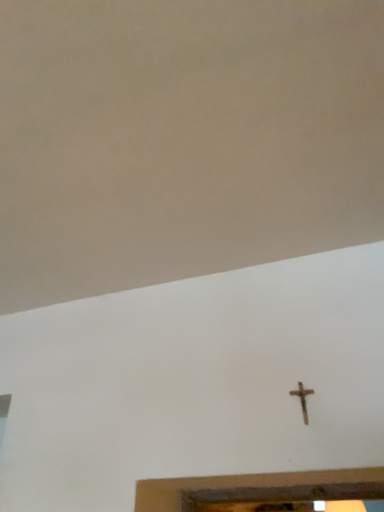
Find the location of a particular element. rusty metal cross at center-right is located at coordinates (302, 399).

Describe the element at coordinates (302, 399) in the screenshot. This screenshot has height=512, width=384. I see `rusty metal cross at center-right` at that location.

Locate an element on the screen. The image size is (384, 512). beige matte wall at upper center is located at coordinates (183, 140).

The height and width of the screenshot is (512, 384). What do you see at coordinates (183, 140) in the screenshot?
I see `beige matte wall at upper center` at bounding box center [183, 140].

This screenshot has height=512, width=384. What are the coordinates of `rusty metal cross at center-right` in the screenshot? It's located at (302, 399).

Between rusty metal cross at center-right and beige matte wall at upper center, which one appears on the right side from the viewer's perspective?

rusty metal cross at center-right is more to the right.

Between rusty metal cross at center-right and beige matte wall at upper center, which one is positioned behind?

rusty metal cross at center-right is more distant.

Does point (300, 382) come behind point (264, 163)?

Yes, it is.

From the image's perspective, is rusty metal cross at center-right located above beige matte wall at upper center?

Actually, rusty metal cross at center-right appears below beige matte wall at upper center in the image.

From a real-world perspective, is rusty metal cross at center-right located higher than beige matte wall at upper center?

Incorrect, from a real-world perspective, rusty metal cross at center-right is lower than beige matte wall at upper center.

Is rusty metal cross at center-right thinner than beige matte wall at upper center?

Correct, the width of rusty metal cross at center-right is less than that of beige matte wall at upper center.

Is rusty metal cross at center-right taller or shorter than beige matte wall at upper center?

Clearly, rusty metal cross at center-right is taller compared to beige matte wall at upper center.

In terms of size, does rusty metal cross at center-right appear bigger or smaller than beige matte wall at upper center?

Clearly, rusty metal cross at center-right is smaller in size than beige matte wall at upper center.

Is rusty metal cross at center-right completely or partially outside of beige matte wall at upper center?

Indeed, rusty metal cross at center-right is completely outside beige matte wall at upper center.

Is rusty metal cross at center-right in contact with beige matte wall at upper center?

rusty metal cross at center-right is not next to beige matte wall at upper center, and they're not touching.

Does rusty metal cross at center-right turn towards beige matte wall at upper center?

No, rusty metal cross at center-right is not facing towards beige matte wall at upper center.

Measure the distance from rusty metal cross at center-right to beige matte wall at upper center.

A distance of 78.89 centimeters exists between rusty metal cross at center-right and beige matte wall at upper center.

Locate an element on the screen. The image size is (384, 512). nail behind the beige matte wall at upper center is located at coordinates (302, 399).

Between beige matte wall at upper center and rusty metal cross at center-right, which one appears on the right side from the viewer's perspective?

Positioned to the right is rusty metal cross at center-right.

Considering their positions, is beige matte wall at upper center located in front of or behind rusty metal cross at center-right?

Clearly, beige matte wall at upper center is in front of rusty metal cross at center-right.

Considering the points (44, 214) and (291, 391), which point is in front, point (44, 214) or point (291, 391)?

Point (44, 214)

From the image's perspective, between beige matte wall at upper center and rusty metal cross at center-right, which one is located above?

From the image's view, beige matte wall at upper center is above.

From a real-world perspective, is beige matte wall at upper center physically below rusty metal cross at center-right?

Actually, beige matte wall at upper center is physically above rusty metal cross at center-right in the real world.

Which object is thinner, beige matte wall at upper center or rusty metal cross at center-right?

Thinner between the two is rusty metal cross at center-right.

Which of these two, beige matte wall at upper center or rusty metal cross at center-right, stands shorter?

Standing shorter between the two is beige matte wall at upper center.

Is beige matte wall at upper center bigger or smaller than rusty metal cross at center-right?

Clearly, beige matte wall at upper center is larger in size than rusty metal cross at center-right.

Is beige matte wall at upper center inside the boundaries of rusty metal cross at center-right, or outside?

beige matte wall at upper center is spatially situated outside rusty metal cross at center-right.

Is beige matte wall at upper center touching rusty metal cross at center-right?

No, beige matte wall at upper center is not touching rusty metal cross at center-right.

Is beige matte wall at upper center facing away from rusty metal cross at center-right?

No, beige matte wall at upper center is not facing the opposite direction of rusty metal cross at center-right.

Can you tell me how much beige matte wall at upper center and rusty metal cross at center-right differ in facing direction?

180 degrees separate the facing orientations of beige matte wall at upper center and rusty metal cross at center-right.

At what (x,y) coordinates should I click in order to perform the action: click on nail behind the beige matte wall at upper center. Please return your answer as a coordinate pair (x, y). Looking at the image, I should click on (302, 399).

Find the location of `nail to the right of beige matte wall at upper center`. nail to the right of beige matte wall at upper center is located at coordinates (302, 399).

Where is `backdrop that is above the rusty metal cross at center-right (from the image's perspective)`? The width and height of the screenshot is (384, 512). backdrop that is above the rusty metal cross at center-right (from the image's perspective) is located at coordinates (183, 140).